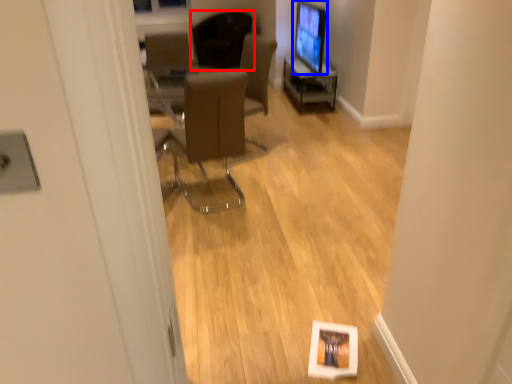
Question: Which object is closer to the camera taking this photo, chair (highlighted by a red box) or computer monitor (highlighted by a blue box)?

Choices:
 (A) chair
 (B) computer monitor

Answer: (B)